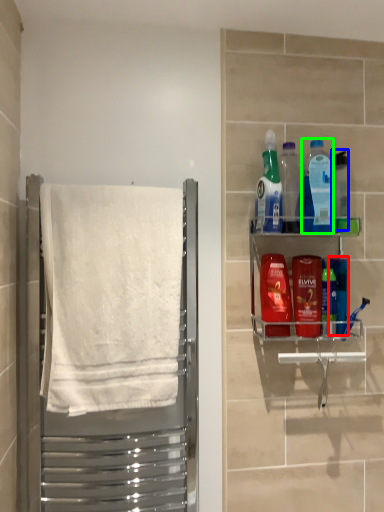
Question: Estimate the real-world distances between objects in this image. Which object is closer to mouthwash (highlighted by a red box), bottle (highlighted by a blue box) or cleaning product (highlighted by a green box)?

Choices:
 (A) bottle
 (B) cleaning product

Answer: (B)